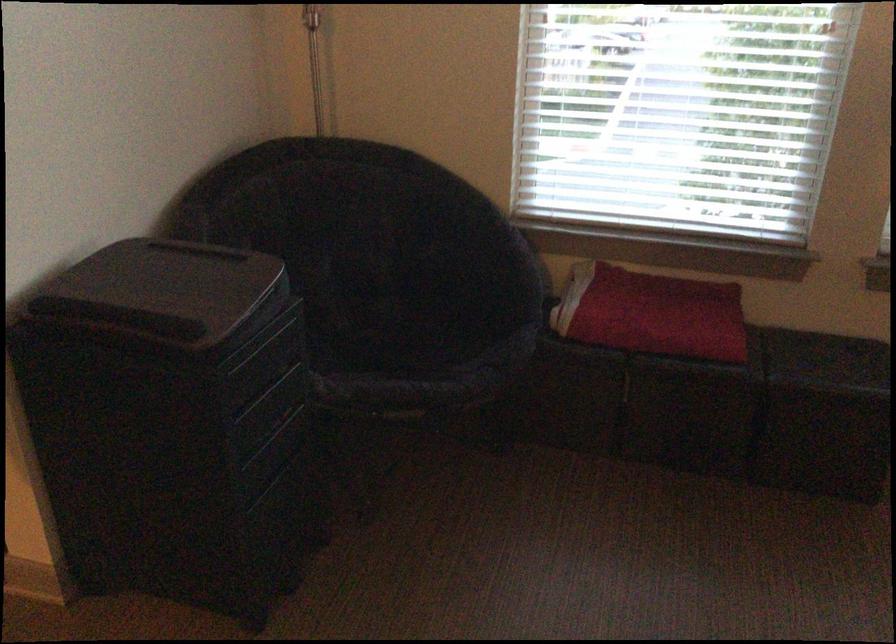
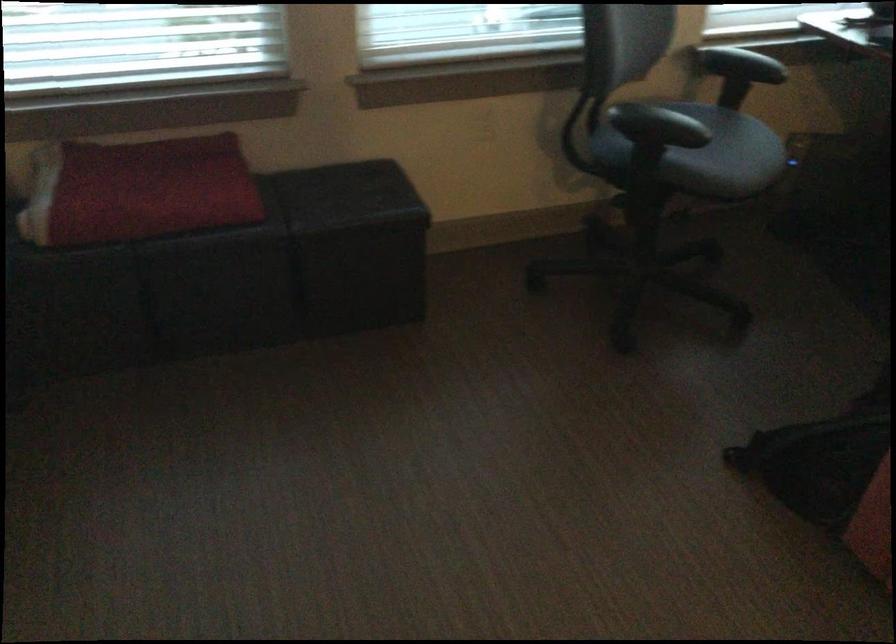
Question: The camera is either moving clockwise (left) or counter-clockwise (right) around the object. The first image is from the beginning of the video and the second image is from the end. Is the camera moving left or right when shooting the video?

Choices:
 (A) Left
 (B) Right

Answer: (A)